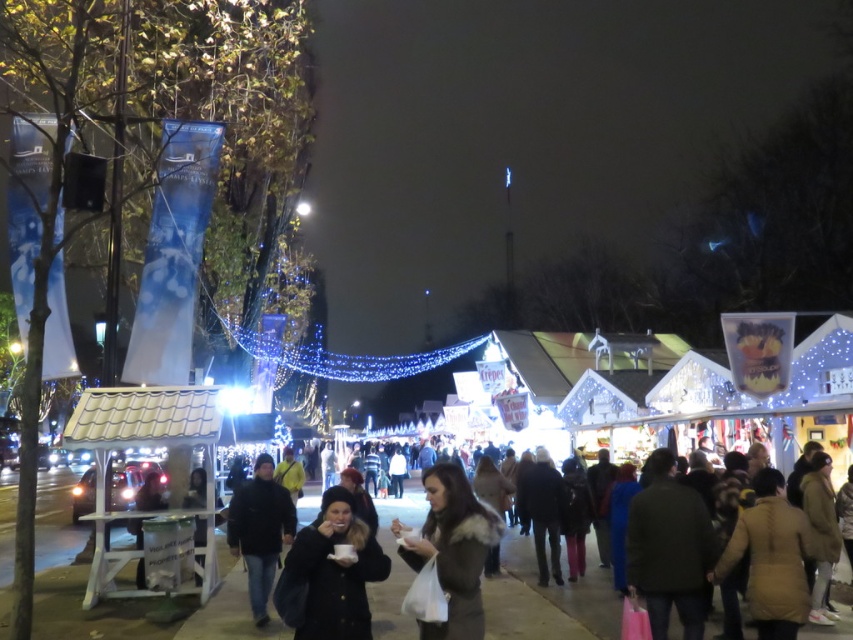
Between point (334, 634) and point (274, 557), which one is positioned in front?

Positioned in front is point (334, 634).

Does point (351, 506) come in front of point (264, 513)?

Yes, point (351, 506) is closer to viewer.

Locate an element on the screen. The image size is (853, 640). black fuzzy hat at center is located at coordinates (329, 573).

Consider the image. Which is above, black fuzzy hat at center or brown fur coat at center?

Positioned higher is brown fur coat at center.

Can you confirm if black fuzzy hat at center is positioned to the left of brown fur coat at center?

Correct, you'll find black fuzzy hat at center to the left of brown fur coat at center.

At what (x,y) coordinates should I click in order to perform the action: click on black fuzzy hat at center. Please return your answer as a coordinate pair (x, y). This screenshot has height=640, width=853. Looking at the image, I should click on (329, 573).

Where is `black fuzzy hat at center`? black fuzzy hat at center is located at coordinates (329, 573).

Is brown fur coat at center to the left of dark blue jacket at center from the viewer's perspective?

No, brown fur coat at center is not to the left of dark blue jacket at center.

This screenshot has height=640, width=853. What do you see at coordinates (453, 550) in the screenshot?
I see `brown fur coat at center` at bounding box center [453, 550].

At what (x,y) coordinates should I click in order to perform the action: click on brown fur coat at center. Please return your answer as a coordinate pair (x, y). Looking at the image, I should click on (x=453, y=550).